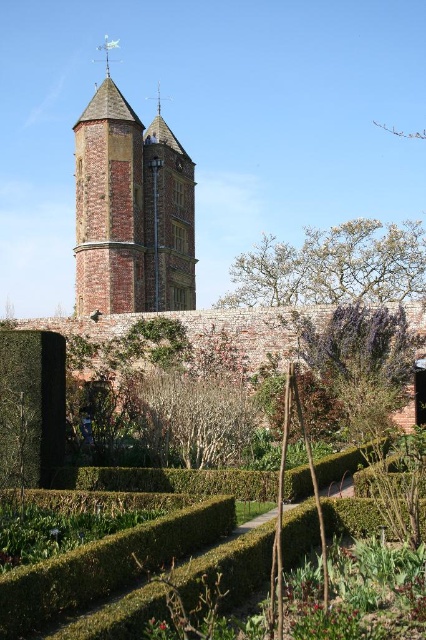
You are a gardener planning to prune bushes in the garden. You see the bare wood bush at center and the green leafy bush at center. Which bush requires more pruning based on their sizes?

The bare wood bush at center requires more pruning because it is larger in size than the green leafy bush at center.

You are a visitor standing at the entrance of the garden. You want to take a photo of the brick stone bell tower at upper center and the green leafy bush at center. If your camera can focus on objects up to 50 meters away, will both subjects be in focus?

The brick stone bell tower at upper center is 43.48 meters away from the green leafy bush at center. Since the camera can focus up to 50 meters, both subjects will be within the focus range and thus in focus.

You are standing at the base of the brick stone bell tower at upper center and want to take a photo of it with your smartphone. Considering the camera is positioned at your eye level, which is approximately 1.7 meters above the ground, can you estimate how far you need to walk backward to capture the entire tower in your photo?

To capture the entire brick stone bell tower at upper center in your photo, you need to walk approximately 63.37 meters backward from your current position at the base, as the camera is positioned 63.37 meters away from the tower.